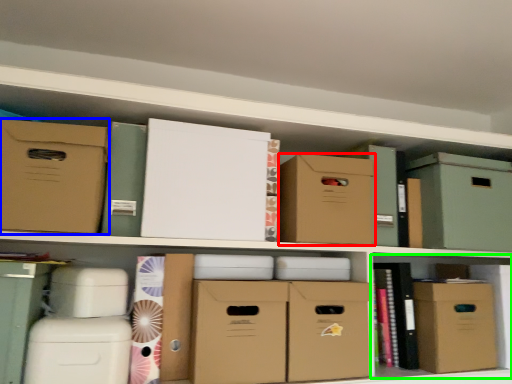
Question: Considering the real-world distances, which object is farthest from cardboard box (highlighted by a red box)? cardboard box (highlighted by a blue box) or cabinet (highlighted by a green box)?

Choices:
 (A) cardboard box
 (B) cabinet

Answer: (A)